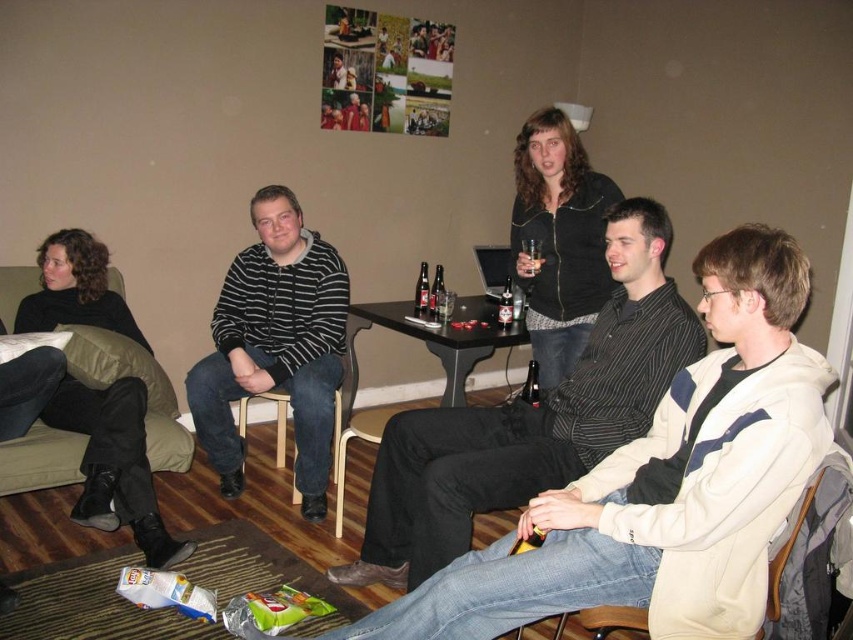
You are a guest at this gathering and want to sit down. You see the black striped hoodie at center and the wooden chair at center. Which object is closer to your current position if you are standing to the right of both objects?

The wooden chair at center is closer to your current position because it is to the right of the black striped hoodie at center, and you are standing to the right of both objects.

You are a bartender who needs to place a coaster under the translucent glass beer bottle at center table to prevent condensation from damaging the black plastic table at center. Will the coaster, which is 3 cm in diameter, fit under the bottle?

The black plastic table at center is taller than the translucent glass beer bottle at center table, but the question is about the coaster fitting under the bottle. Since the coaster is 3 cm in diameter and the bottle is a standard size, it is likely the coaster will fit under the translucent glass beer bottle at center table.

You are a guest at this gathering and want to sit down. There are two options available to you, the black fabric couch at left and the wooden chair at center. Which one is located to the left of the other?

The black fabric couch at left is positioned on the left side of wooden chair at center, so the black fabric couch at left is to the left of the wooden chair at center.